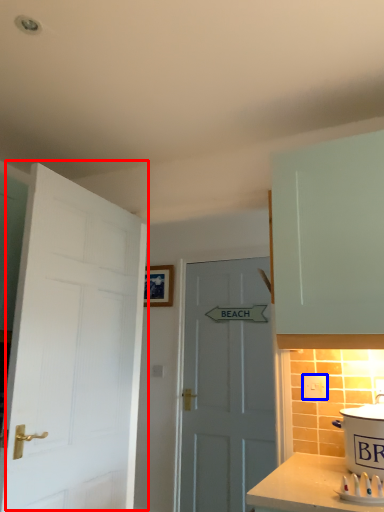
Question: Which object is further to the camera taking this photo, door (highlighted by a red box) or electric outlet (highlighted by a blue box)?

Choices:
 (A) door
 (B) electric outlet

Answer: (B)